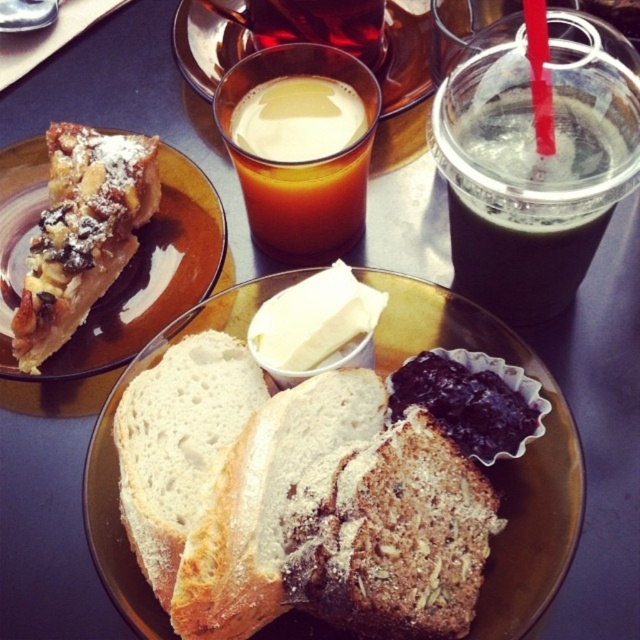
Is point (28, 208) positioned after point (284, 28)?

No.

At what (x,y) coordinates should I click in order to perform the action: click on powdery brown pastry at upper left. Please return your answer as a coordinate pair (x, y). The width and height of the screenshot is (640, 640). Looking at the image, I should click on (154, 273).

Measure the distance between powdery brown pastry at upper left and camera.

14.02 inches

The width and height of the screenshot is (640, 640). In order to click on powdery brown pastry at upper left in this screenshot , I will do `click(154, 273)`.

Is golden liquid at center in front of dark purple jam at center?

That is False.

The image size is (640, 640). Describe the element at coordinates (301, 160) in the screenshot. I see `golden liquid at center` at that location.

What do you see at coordinates (301, 160) in the screenshot? Image resolution: width=640 pixels, height=640 pixels. I see `golden liquid at center` at bounding box center [301, 160].

You are a GUI agent. You are given a task and a screenshot of the screen. Output one action in this format:
    pyautogui.click(x=<x>, y=<y>)
    Task: Click on the golden liquid at center
    The width and height of the screenshot is (640, 640).
    Given the screenshot: What is the action you would take?
    pyautogui.click(x=301, y=160)

Who is positioned more to the right, slightly toasted bread at center or white soft bread at center?

slightly toasted bread at center is more to the right.

Locate an element on the screen. slightly toasted bread at center is located at coordinates (499, 460).

The height and width of the screenshot is (640, 640). Find the location of `slightly toasted bread at center`. slightly toasted bread at center is located at coordinates (499, 460).